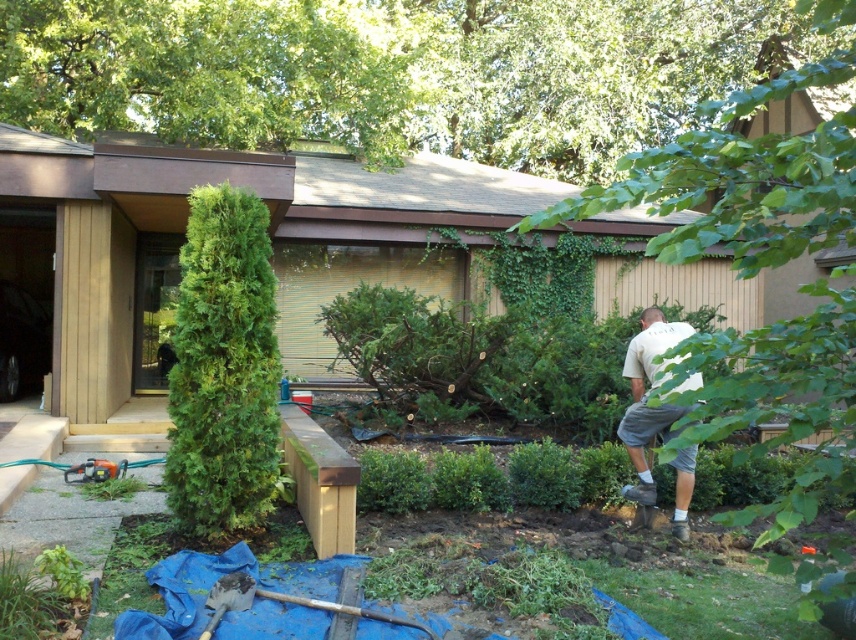
Between green leafy tree at upper center and white cotton shirt at lower right, which one has more height?

With more height is white cotton shirt at lower right.

Measure the distance between green leafy tree at upper center and camera.

17.10 meters

The height and width of the screenshot is (640, 856). Describe the element at coordinates (214, 72) in the screenshot. I see `green leafy tree at upper center` at that location.

In order to click on green leafy tree at upper center in this screenshot , I will do `click(214, 72)`.

Does green textured evergreen tree at left appear over white cotton shirt at lower right?

Correct, green textured evergreen tree at left is located above white cotton shirt at lower right.

Does green textured evergreen tree at left appear on the right side of white cotton shirt at lower right?

In fact, green textured evergreen tree at left is to the left of white cotton shirt at lower right.

The width and height of the screenshot is (856, 640). I want to click on green textured evergreen tree at left, so click(x=223, y=368).

Does green leafy tree at center have a smaller size compared to green textured evergreen tree at left?

Actually, green leafy tree at center might be larger than green textured evergreen tree at left.

Is green leafy tree at center thinner than green textured evergreen tree at left?

No.

Between point (752, 243) and point (248, 396), which one is positioned in front?

Positioned in front is point (752, 243).

The height and width of the screenshot is (640, 856). I want to click on green leafy tree at center, so click(736, 193).